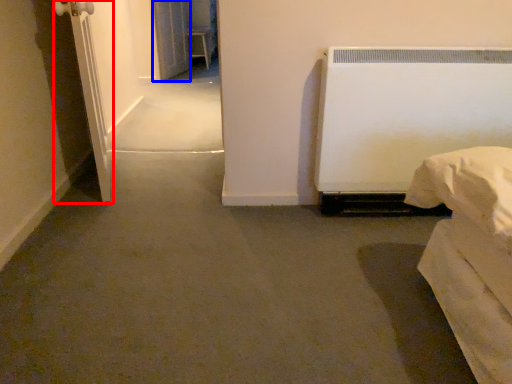
Question: Which object is further to the camera taking this photo, screen door (highlighted by a red box) or screen door (highlighted by a blue box)?

Choices:
 (A) screen door
 (B) screen door

Answer: (B)